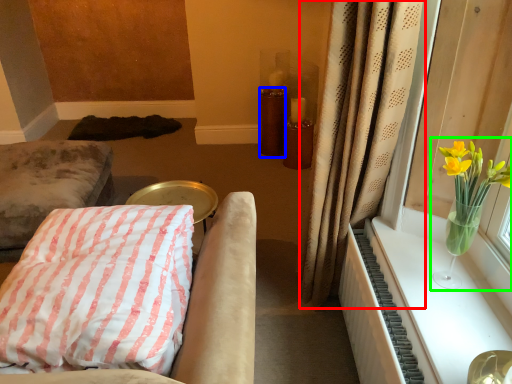
Question: Estimate the real-world distances between objects in this image. Which object is closer to curtain (highlighted by a red box), candle holder (highlighted by a blue box) or floral arrangement (highlighted by a green box)?

Choices:
 (A) candle holder
 (B) floral arrangement

Answer: (B)